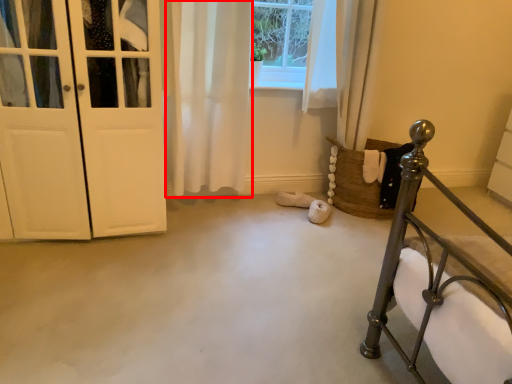
Question: Where is curtain (annotated by the red box) located in relation to door in the image?

Choices:
 (A) left
 (B) right

Answer: (B)